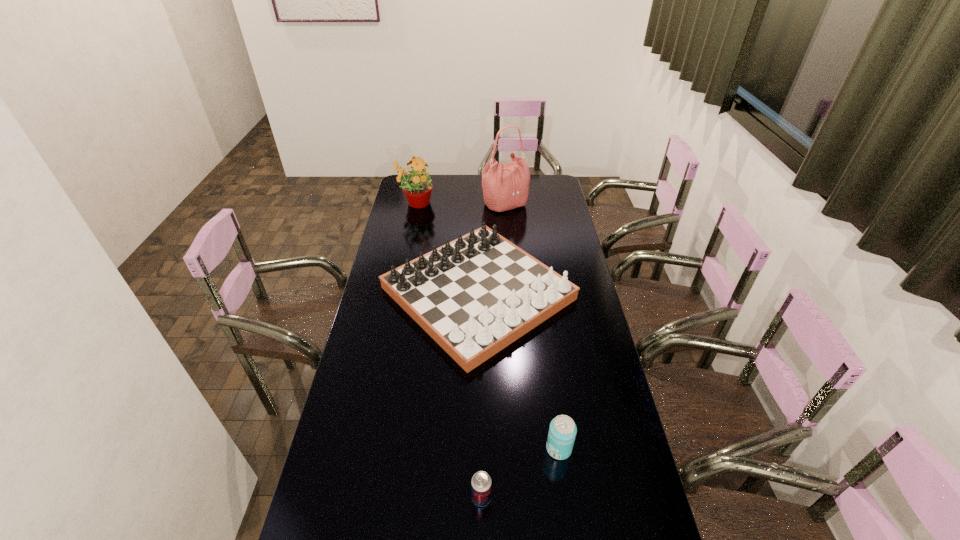
You are a GUI agent. You are given a task and a screenshot of the screen. Output one action in this format:
    pyautogui.click(x=<x>, y=<y>)
    Task: Click on the vacant area situated on the back of the gameboard
    The width and height of the screenshot is (960, 540).
    Given the screenshot: What is the action you would take?
    click(x=478, y=214)

The width and height of the screenshot is (960, 540). Identify the location of free space located on the back of the right beer can. (552, 399).

The height and width of the screenshot is (540, 960). I want to click on vacant point located 0.350m on the right of the nearer beer can, so click(x=623, y=498).

Locate an element on the screen. handbag present at the far edge is located at coordinates (505, 186).

The height and width of the screenshot is (540, 960). In order to click on flowerpot situated at the far edge in this screenshot , I will do `click(417, 187)`.

Locate an element on the screen. flowerpot located at the left edge is located at coordinates (417, 187).

Find the location of a particular element. The width and height of the screenshot is (960, 540). gameboard located in the left edge section of the desktop is located at coordinates [x=474, y=296].

Locate an element on the screen. object that is at the right edge is located at coordinates (474, 296).

Find the location of `object present at the far left corner`. object present at the far left corner is located at coordinates (417, 187).

Locate an element on the screen. The image size is (960, 540). free space at the far edge of the desktop is located at coordinates (470, 177).